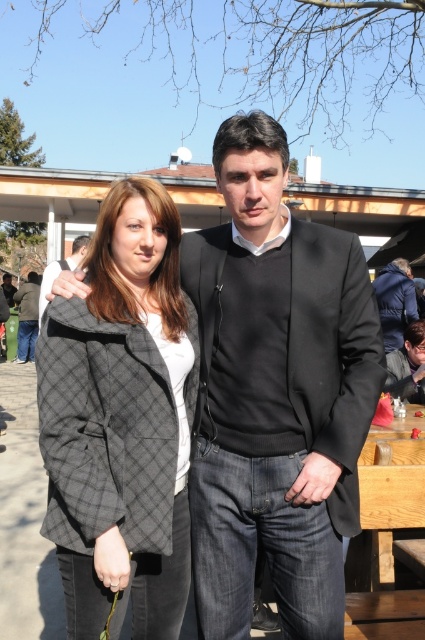
You are standing at the origin point in the image and want to move towards the point labeled point (263, 352) and point (376, 502). Which point is closer to you?

Point (263, 352) is in front of point (376, 502), so it is closer to you.

You are planning to sit at the wooden picnic table at lower right for a picnic. There is a plaid wool coat at center nearby. Which side of the table should you place the coat so it doesn not block the view of the table?

The plaid wool coat at center is positioned on the left side of the wooden picnic table at lower right. To avoid blocking the view of the table, you should place the coat on the right side away from the coat.